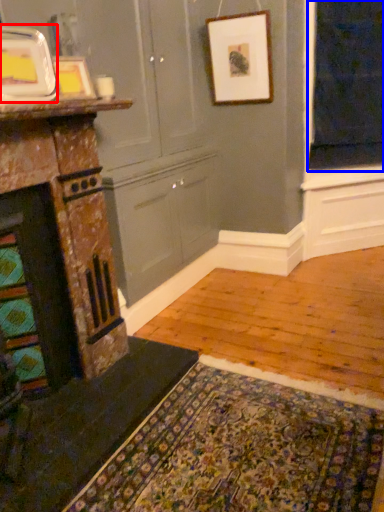
Question: Which object is closer to the camera taking this photo, picture frame (highlighted by a red box) or window screen (highlighted by a blue box)?

Choices:
 (A) picture frame
 (B) window screen

Answer: (A)